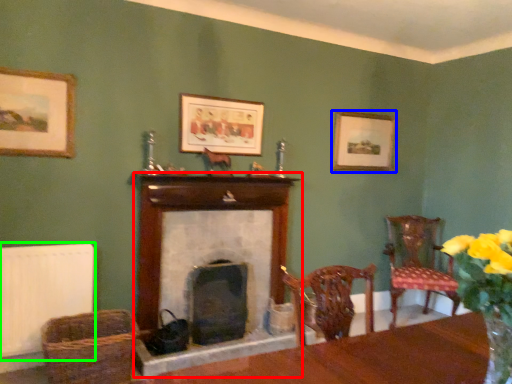
Question: Estimate the real-world distances between objects in this image. Which object is closer to fireplace (highlighted by a red box), picture frame (highlighted by a blue box) or radiator (highlighted by a green box)?

Choices:
 (A) picture frame
 (B) radiator

Answer: (B)